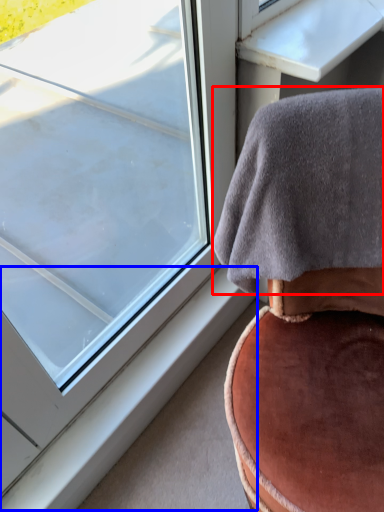
Question: Among these objects, which one is nearest to the camera, blanket (highlighted by a red box) or window sill (highlighted by a blue box)?

Choices:
 (A) blanket
 (B) window sill

Answer: (A)